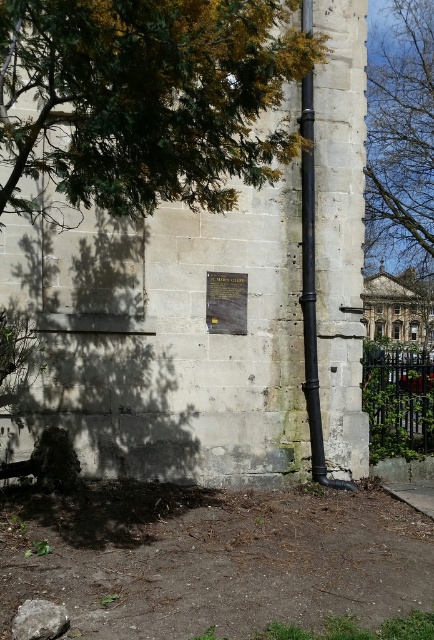
You are standing in front of the stone wall and want to take a photo of the plaque. However, there is a black metal fence at lower right and a black matte pipe at right in the way. Which object is closer to you, making it harder to take a clear photo?

The black metal fence at lower right is closer to you than the black matte pipe at right, so it is the object blocking your view of the plaque.

Looking at this image, you are an architect examining the stone wall. You notice the green leafy tree at upper left and the black metal fence at lower right. Which object takes up more space in the image?

The green leafy tree at upper left takes up more space in the image than the black metal fence at lower right because it is bigger.

You are standing in front of the historic stone wall and need to locate both the green leafy tree at upper left and the black metal fence at lower right. Which object is positioned more to the left side of the wall?

The green leafy tree at upper left is positioned more to the left side of the wall compared to the black metal fence at lower right.